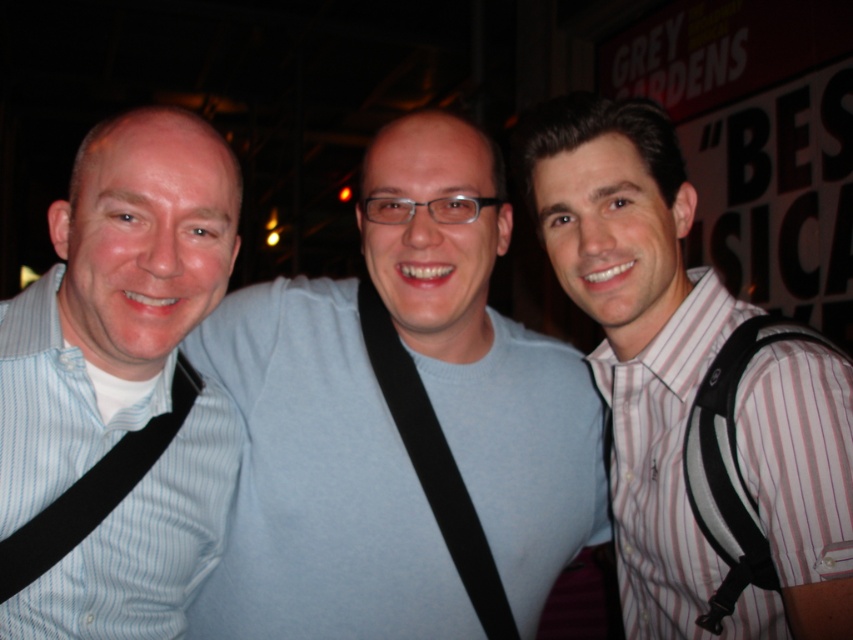
Question: Among these objects, which one is nearest to the camera?

Choices:
 (A) black fabric strap at center
 (B) blue striped shirt at left

Answer: (B)

Question: Does striped cotton shirt at right appear on the left side of black fabric strap at left?

Choices:
 (A) yes
 (B) no

Answer: (B)

Question: Is light blue sweater at center above black fabric strap at left?

Choices:
 (A) no
 (B) yes

Answer: (B)

Question: Which is nearer to the light blue sweater at center?

Choices:
 (A) blue striped shirt at left
 (B) black fabric strap at center
 (C) striped cotton shirt at right
 (D) black fabric strap at left

Answer: (B)

Question: Is striped cotton shirt at right thinner than black fabric strap at left?

Choices:
 (A) yes
 (B) no

Answer: (B)

Question: Considering the real-world distances, which object is farthest from the black fabric strap at left?

Choices:
 (A) black fabric strap at center
 (B) blue striped shirt at left
 (C) light blue sweater at center

Answer: (A)